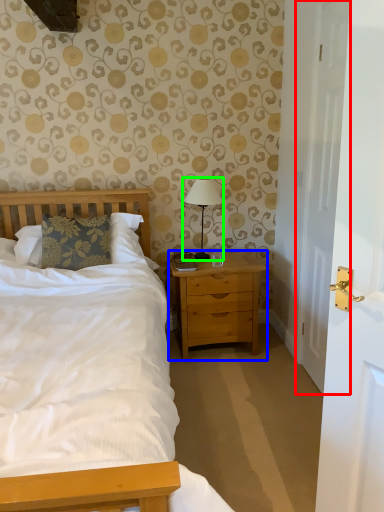
Question: Based on their relative distances, which object is nearer to door (highlighted by a red box)? Choose from nightstand (highlighted by a blue box) and bedside lamp (highlighted by a green box).

Choices:
 (A) nightstand
 (B) bedside lamp

Answer: (A)